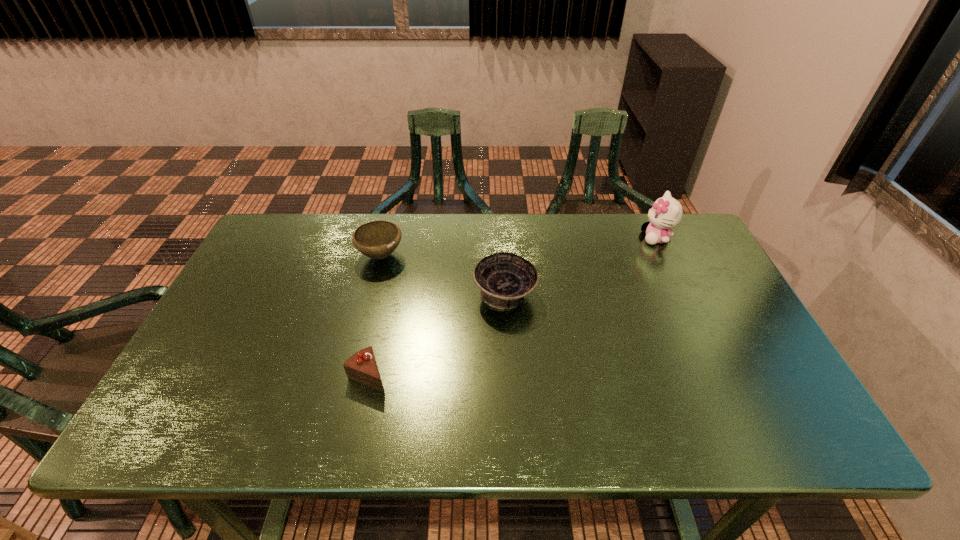
At what (x,y) coordinates should I click in order to perform the action: click on free space at the right edge of the desktop. Please return your answer as a coordinate pair (x, y). Image resolution: width=960 pixels, height=540 pixels. Looking at the image, I should click on (674, 277).

The height and width of the screenshot is (540, 960). What are the coordinates of `vacant space at the far right corner of the desktop` in the screenshot? It's located at (659, 245).

The image size is (960, 540). I want to click on free space between the right bowl and the shortest object, so click(x=437, y=336).

Where is `free space between the nearest object and the farther bowl`? The width and height of the screenshot is (960, 540). free space between the nearest object and the farther bowl is located at coordinates (374, 316).

Image resolution: width=960 pixels, height=540 pixels. Find the location of `free area in between the left bowl and the shortest object`. free area in between the left bowl and the shortest object is located at coordinates (374, 316).

Find the location of a particular element. This screenshot has height=540, width=960. free space between the second object from right to left and the nearest object is located at coordinates [x=437, y=336].

Where is `vacant space that is in between the right bowl and the chocolate cake`? vacant space that is in between the right bowl and the chocolate cake is located at coordinates (437, 336).

Where is `free space between the nearest object and the farther bowl`? free space between the nearest object and the farther bowl is located at coordinates (374, 316).

You are a GUI agent. You are given a task and a screenshot of the screen. Output one action in this format:
    pyautogui.click(x=<x>, y=<y>)
    Task: Click on the free point between the left bowl and the shortest object
    The height and width of the screenshot is (540, 960).
    Given the screenshot: What is the action you would take?
    (374, 316)

The width and height of the screenshot is (960, 540). What are the coordinates of `object that is the second closest to the shortest object` in the screenshot? It's located at (378, 239).